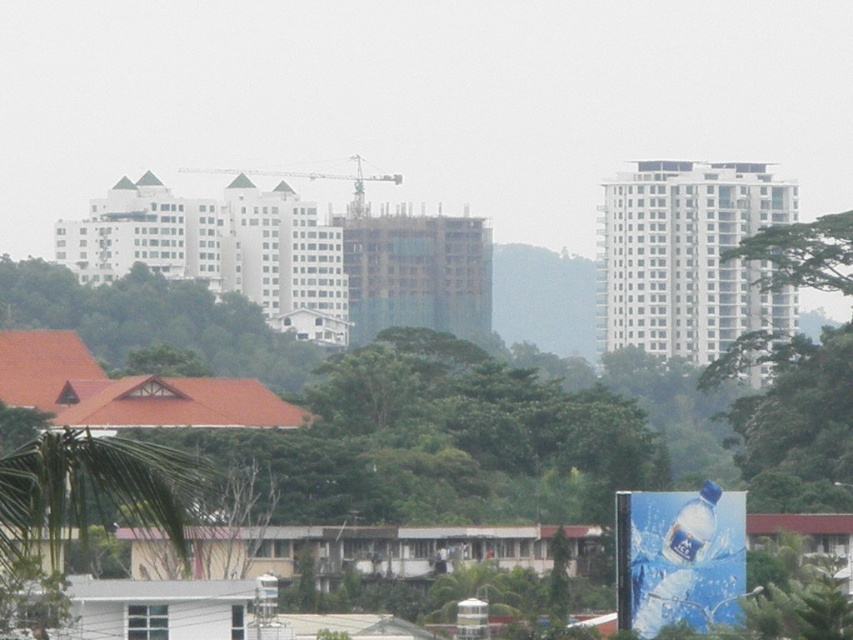
Measure the distance from green leafy tree at right to green leafy tree at lower left.

green leafy tree at right and green leafy tree at lower left are 238.12 meters apart from each other.

Between green leafy tree at right and green leafy tree at lower left, which one is positioned higher?

green leafy tree at right is above.

Describe the element at coordinates (792, 416) in the screenshot. This screenshot has width=853, height=640. I see `green leafy tree at right` at that location.

I want to click on green leafy tree at right, so click(792, 416).